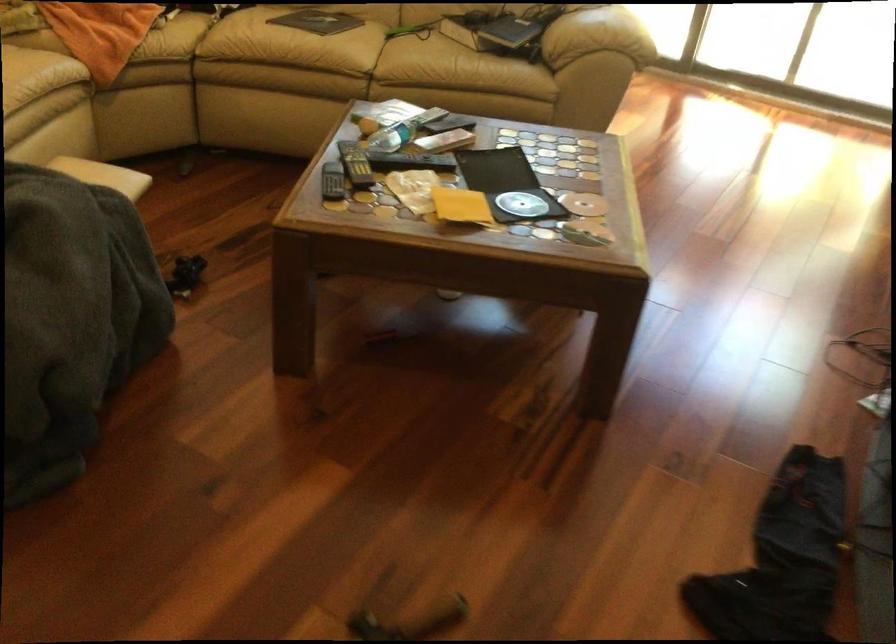
Where would you lift the blue book? Please return your answer as a coordinate pair (x, y).

(510, 31)